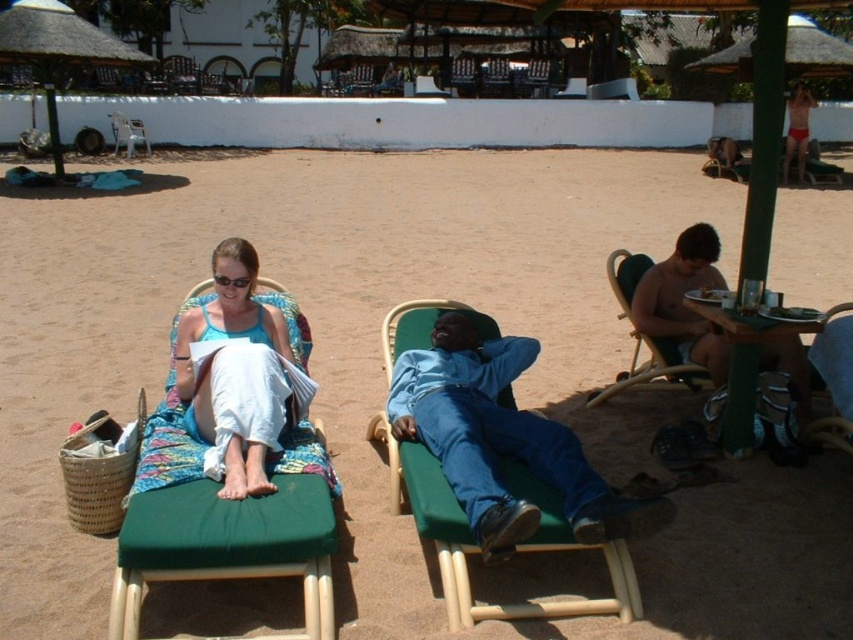
Question: Is shiny metallic plate at center thinner than metallic silver beach chair at upper left?

Choices:
 (A) no
 (B) yes

Answer: (B)

Question: Which of the following is the farthest from the observer?

Choices:
 (A) (605, 515)
 (B) (821, 342)

Answer: (B)

Question: Can you confirm if denim blue jeans at center is positioned to the left of blue fabric beach chair at lower right?

Choices:
 (A) no
 (B) yes

Answer: (B)

Question: Which point appears farthest from the camera in this image?

Choices:
 (A) (566, 435)
 (B) (119, 145)

Answer: (B)

Question: Which of the following is the farthest from the observer?

Choices:
 (A) wooden beach chair at center
 (B) green fabric beach chair at left
 (C) metallic silver beach chair at upper left
 (D) blue fabric beach chair at lower right

Answer: (C)

Question: Can you confirm if blue fabric beach chair at lower right is positioned to the right of red fabric bikini at upper right?

Choices:
 (A) no
 (B) yes

Answer: (A)